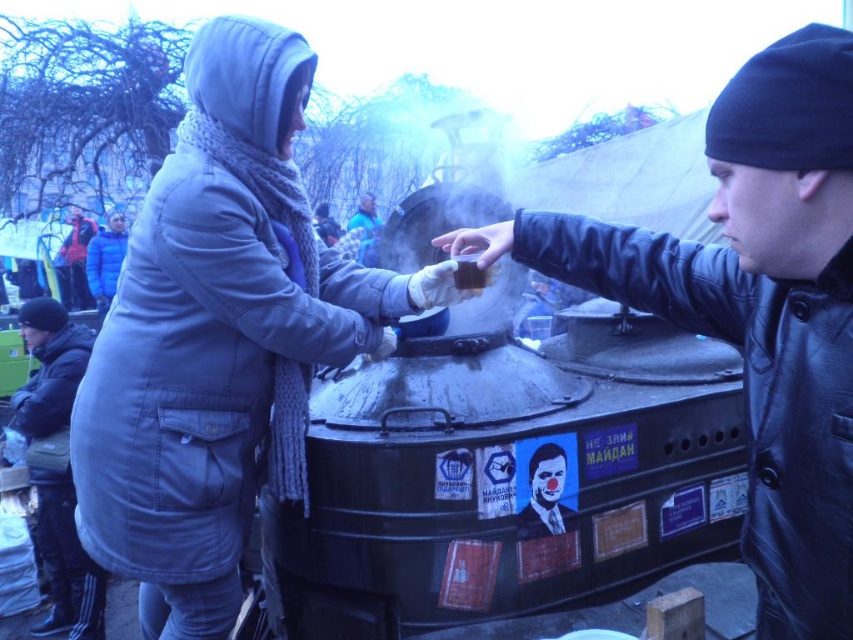
Does matte gray coat at center have a lesser height compared to black leather jacket at center?

No, matte gray coat at center is not shorter than black leather jacket at center.

Between point (120, 528) and point (762, 413), which one is positioned in front?

Point (762, 413)

Which is in front, point (113, 365) or point (741, 228)?

Point (741, 228) is in front.

This screenshot has width=853, height=640. I want to click on matte gray coat at center, so click(x=219, y=339).

Can you confirm if black leather jacket at center is positioned below dark blue leather jacket at lower left?

No.

Can you confirm if black leather jacket at center is bigger than dark blue leather jacket at lower left?

Indeed, black leather jacket at center has a larger size compared to dark blue leather jacket at lower left.

Which is in front, point (822, 428) or point (62, 358)?

Point (822, 428)

I want to click on black leather jacket at center, so click(x=753, y=307).

Who is lower down, matte gray coat at center or dark blue leather jacket at lower left?

dark blue leather jacket at lower left is lower down.

Measure the distance from matte gray coat at center to dark blue leather jacket at lower left.

They are 2.33 meters apart.

Measure the distance between point (96, 387) and camera.

Point (96, 387) is 9.39 feet away from camera.

The width and height of the screenshot is (853, 640). Identify the location of matte gray coat at center. pos(219,339).